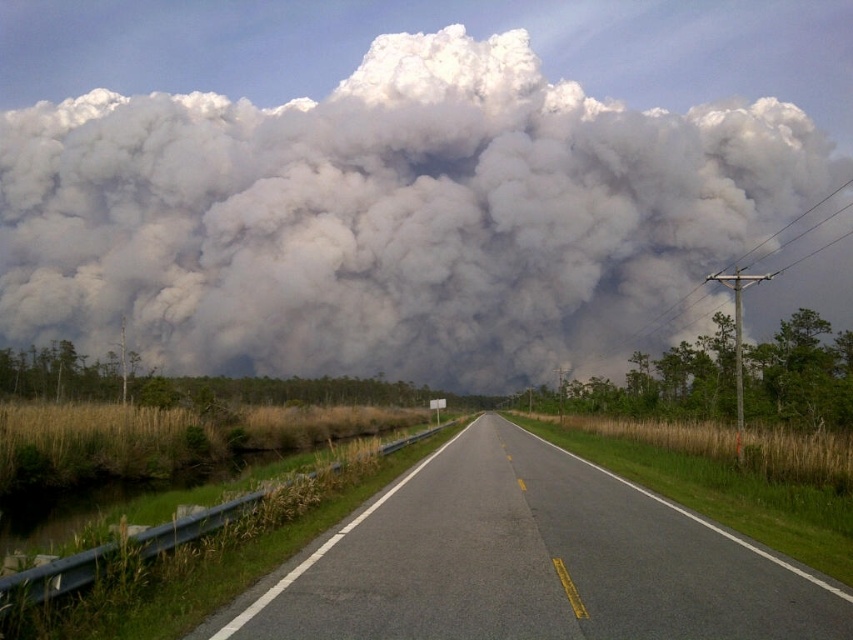
You are a pedestrian standing on the road and want to reach both the point at coordinates (631, 216) and the point at coordinates (454, 579). Which point should you reach first to minimize your walking distance?

You should reach the point at coordinates (454, 579) first because it is closer to you than the point at coordinates (631, 216), which is further away.